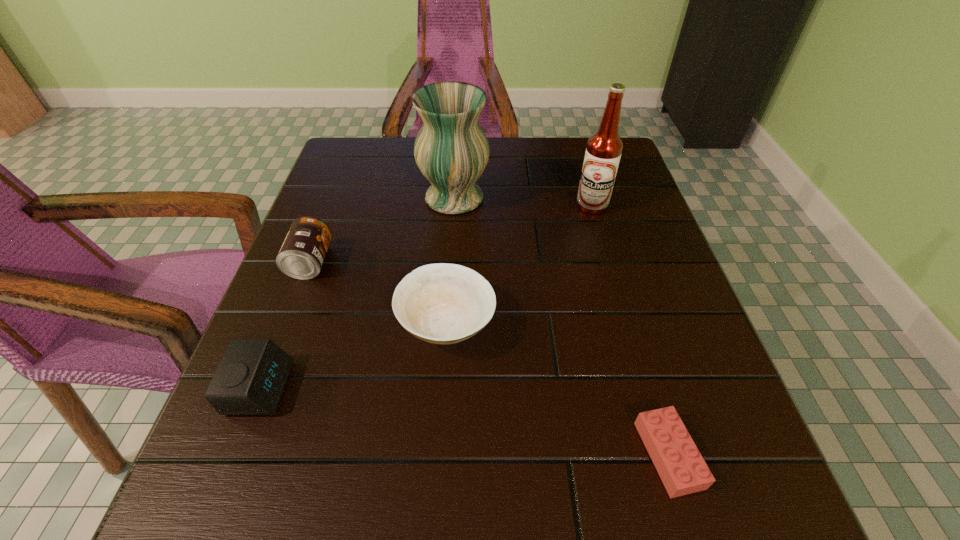
Identify the location of vacant position at the near edge of the desktop. (573, 478).

The width and height of the screenshot is (960, 540). Find the location of `vacant space at the left edge`. vacant space at the left edge is located at coordinates (317, 327).

In the image, there is a desktop. Where is `free space at the right edge`? This screenshot has height=540, width=960. free space at the right edge is located at coordinates (600, 270).

The image size is (960, 540). I want to click on vacant space at the far left corner of the desktop, so click(x=329, y=179).

Where is `vacant region between the alcohol and the bowl`? vacant region between the alcohol and the bowl is located at coordinates (519, 265).

At what (x,y) coordinates should I click in order to perform the action: click on free space that is in between the alarm clock and the Lego. Please return your answer as a coordinate pair (x, y). Looking at the image, I should click on (465, 421).

This screenshot has width=960, height=540. I want to click on unoccupied position between the alcohol and the fourth nearest object, so click(x=451, y=234).

I want to click on empty space between the alarm clock and the can, so click(285, 325).

Find the location of a particular element. empty location between the vase and the alcohol is located at coordinates (523, 202).

Find the location of a particular element. Image resolution: width=960 pixels, height=540 pixels. vacant area that lies between the shortest object and the alcohol is located at coordinates (630, 330).